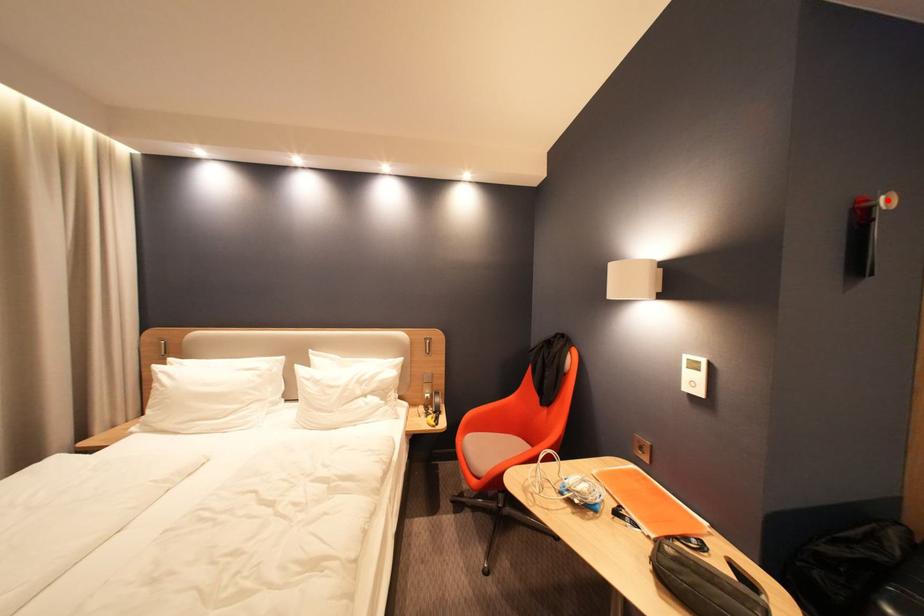
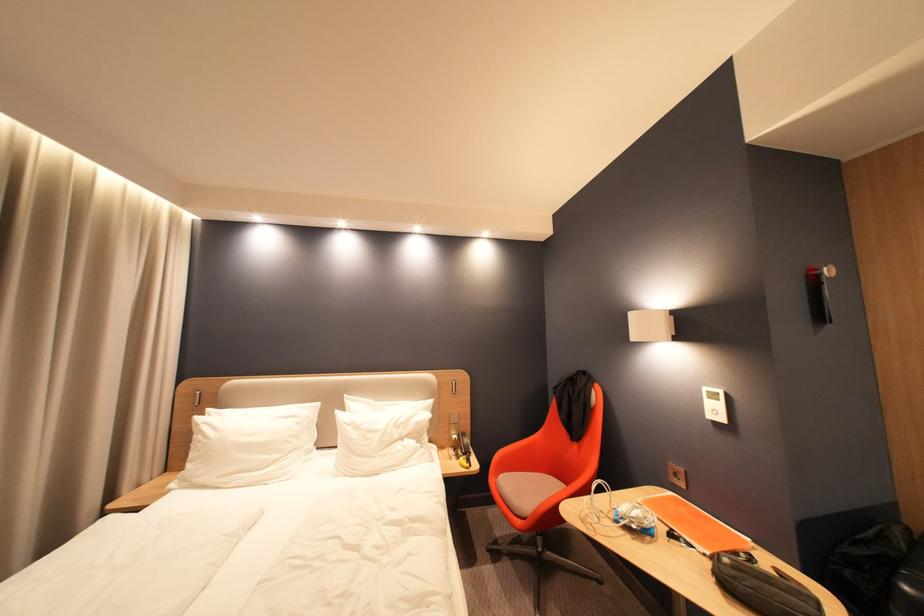
In the second image, find the point that corresponds to the highlighted location in the first image.

(830, 270)